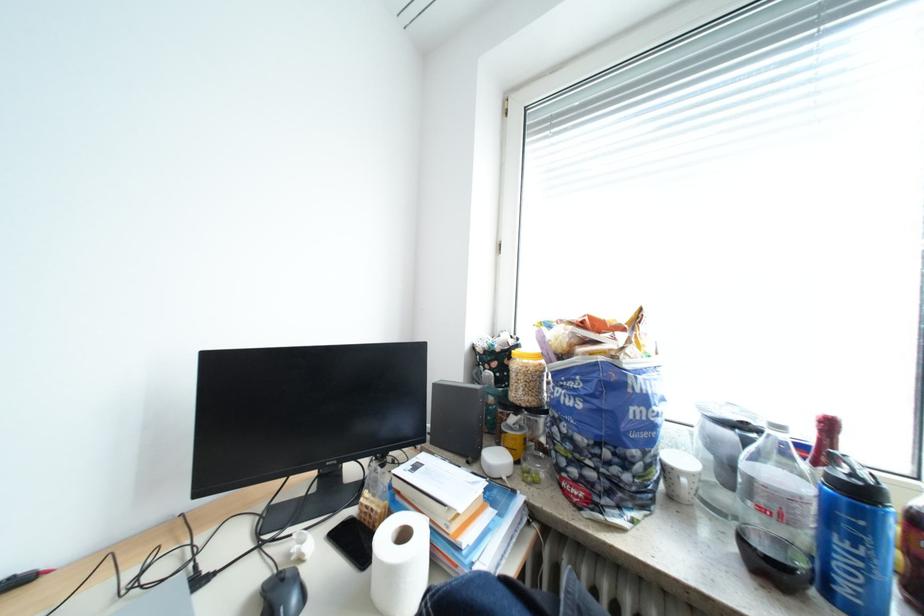
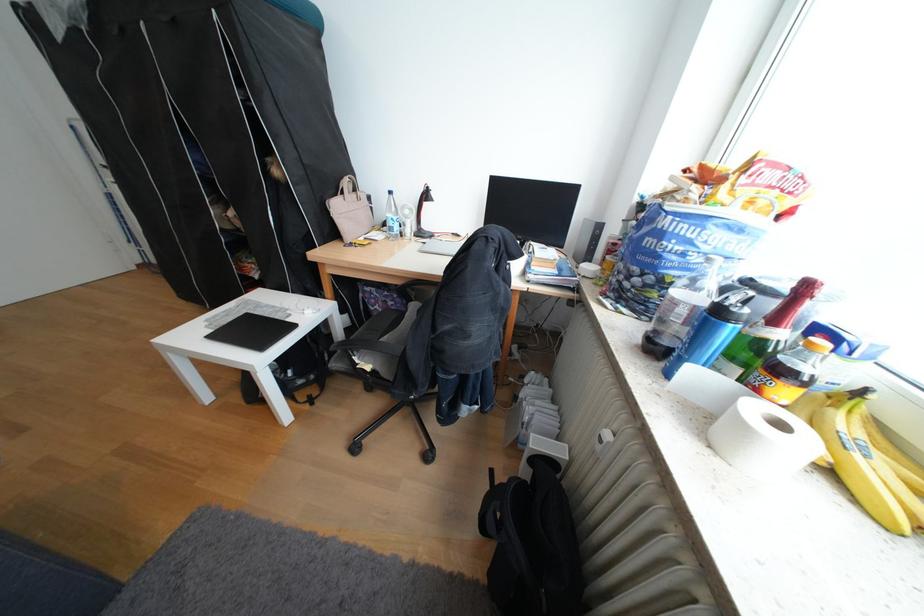
Where in the second image is the point corresponding to point 825,509 from the first image?

(695, 312)